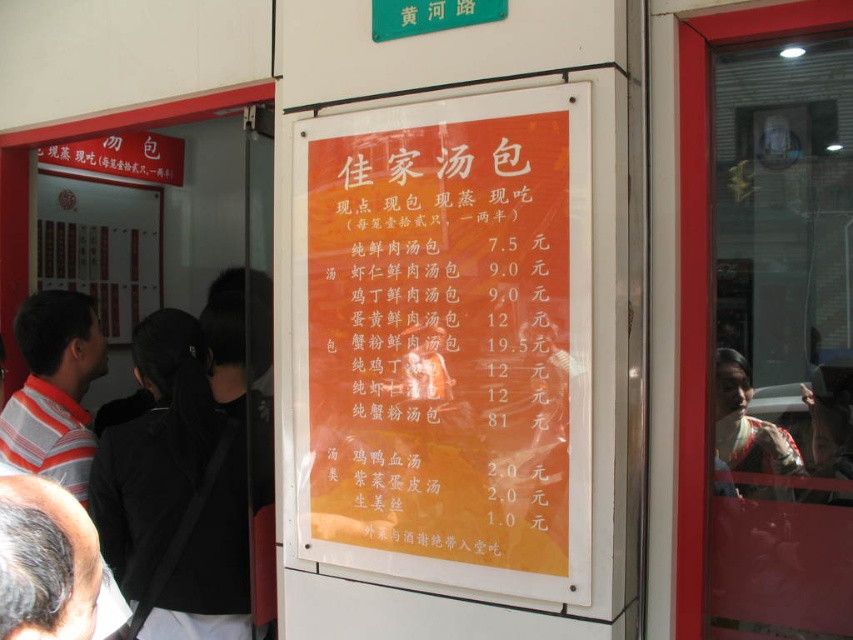
Between orange paper menu at center and striped cotton shirt at left, which one has more height?

Standing taller between the two is orange paper menu at center.

Is orange paper menu at center thinner than striped cotton shirt at left?

No, orange paper menu at center is not thinner than striped cotton shirt at left.

Is point (379, 449) more distant than point (15, 458)?

No, it is not.

Locate an element on the screen. orange paper menu at center is located at coordinates (445, 340).